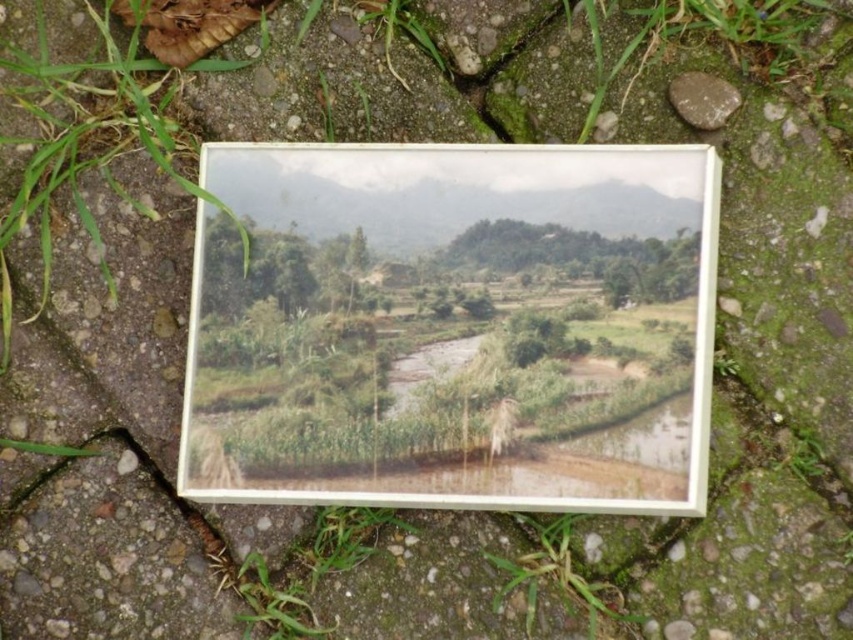
Does point (399, 196) come behind point (714, 77)?

No, (399, 196) is in front of (714, 77).

Measure the distance between matte paper photo at center and brown matte stone at upper right.

14.96 inches

Who is more distant from viewer, (402, 465) or (706, 106)?

Point (706, 106)

Where is `matte paper photo at center`? This screenshot has height=640, width=853. matte paper photo at center is located at coordinates 457,321.

Looking at this image, between green grass at lower left and brown matte stone at upper right, which one appears on the left side from the viewer's perspective?

green grass at lower left

Between point (248, 612) and point (701, 86), which one is positioned in front?

Point (248, 612) is in front.

Is point (252, 580) less distant than point (689, 115)?

No, it is not.

Locate an element on the screen. green grass at lower left is located at coordinates (276, 604).

Does matte paper photo at center appear over green matte grass at lower center?

Indeed, matte paper photo at center is positioned over green matte grass at lower center.

Can you confirm if matte paper photo at center is shorter than green matte grass at lower center?

No.

Which is in front, point (508, 410) or point (514, 568)?

Point (508, 410) is in front.

Find the location of `matte paper photo at center`. matte paper photo at center is located at coordinates (457, 321).